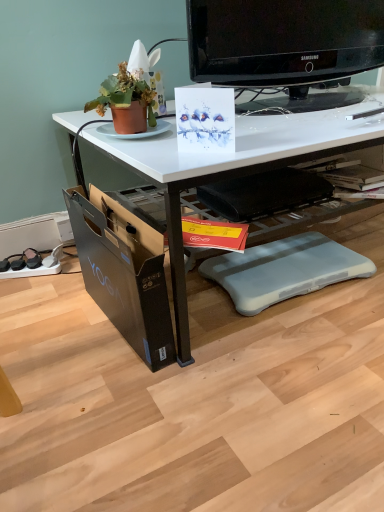
The image size is (384, 512). Describe the element at coordinates (264, 193) in the screenshot. I see `black plastic swivel chair at center, placed as the 1th swivel chair when sorted from top to bottom` at that location.

The image size is (384, 512). Describe the element at coordinates (284, 270) in the screenshot. I see `gray plastic swivel chair at lower center, placed as the second swivel chair when sorted from top to bottom` at that location.

Measure the distance between black glossy television at upper center and camera.

The distance of black glossy television at upper center from camera is 3.55 feet.

The image size is (384, 512). Describe the element at coordinates (129, 94) in the screenshot. I see `terracotta clay pot at upper left` at that location.

The height and width of the screenshot is (512, 384). What do you see at coordinates (213, 234) in the screenshot?
I see `yellow paper magazine at center` at bounding box center [213, 234].

In order to click on yellow paper magazine at center in this screenshot , I will do `click(213, 234)`.

Where is `white glossy desk at center`? This screenshot has height=512, width=384. white glossy desk at center is located at coordinates (236, 168).

Which of these two, gray plastic swivel chair at lower center, the 1th swivel chair from the bottom, or black cardboard file cabinet at lower left, stands taller?

With more height is black cardboard file cabinet at lower left.

Is gray plastic swivel chair at lower center, the 1th swivel chair from the bottom, situated inside black cardboard file cabinet at lower left or outside?

gray plastic swivel chair at lower center, the 1th swivel chair from the bottom, is not inside black cardboard file cabinet at lower left, it's outside.

From the image's perspective, is gray plastic swivel chair at lower center, placed as the second swivel chair when sorted from top to bottom, on black cardboard file cabinet at lower left?

Incorrect, from the image's perspective, gray plastic swivel chair at lower center, placed as the second swivel chair when sorted from top to bottom, is lower than black cardboard file cabinet at lower left.

Does point (258, 262) appear closer or farther from the camera than point (163, 245)?

Point (258, 262).

Could you tell me if black plastic swivel chair at center, placed as the 1th swivel chair when sorted from top to bottom, is facing gray plastic swivel chair at lower center, placed as the second swivel chair when sorted from top to bottom?

No.

From a real-world perspective, which is physically above, black plastic swivel chair at center, placed as the 1th swivel chair when sorted from top to bottom, or gray plastic swivel chair at lower center, the 1th swivel chair from the bottom?

In real-world perspective, black plastic swivel chair at center, placed as the 1th swivel chair when sorted from top to bottom, is above.

Is black plastic swivel chair at center, the 2th swivel chair when ordered from bottom to top, placed right next to gray plastic swivel chair at lower center, the 1th swivel chair from the bottom?

black plastic swivel chair at center, the 2th swivel chair when ordered from bottom to top, and gray plastic swivel chair at lower center, the 1th swivel chair from the bottom, are clearly separated.

Where is `the 1st swivel chair to the right of the yellow paper magazine at center, counting from the anchor's position`? This screenshot has height=512, width=384. the 1st swivel chair to the right of the yellow paper magazine at center, counting from the anchor's position is located at coordinates (264, 193).

From a real-world perspective, is black plastic swivel chair at center, the 2th swivel chair when ordered from bottom to top, under yellow paper magazine at center?

Incorrect, from a real-world perspective, black plastic swivel chair at center, the 2th swivel chair when ordered from bottom to top, is higher than yellow paper magazine at center.

Considering the relative sizes of black plastic swivel chair at center, the 2th swivel chair when ordered from bottom to top, and yellow paper magazine at center in the image provided, is black plastic swivel chair at center, the 2th swivel chair when ordered from bottom to top, thinner than yellow paper magazine at center?

No, black plastic swivel chair at center, the 2th swivel chair when ordered from bottom to top, is not thinner than yellow paper magazine at center.

Is black cardboard file cabinet at lower left positioned far away from black plastic swivel chair at center, the 2th swivel chair when ordered from bottom to top?

No, black cardboard file cabinet at lower left is not far away from black plastic swivel chair at center, the 2th swivel chair when ordered from bottom to top.

From a real-world perspective, is black cardboard file cabinet at lower left located beneath black plastic swivel chair at center, the 2th swivel chair when ordered from bottom to top?

Yes, from a real-world perspective, black cardboard file cabinet at lower left is under black plastic swivel chair at center, the 2th swivel chair when ordered from bottom to top.

Does black cardboard file cabinet at lower left contain black plastic swivel chair at center, the 2th swivel chair when ordered from bottom to top?

That's incorrect, black plastic swivel chair at center, the 2th swivel chair when ordered from bottom to top, is not inside black cardboard file cabinet at lower left.

In the image, is black cardboard file cabinet at lower left positioned in front of or behind black plastic swivel chair at center, placed as the 1th swivel chair when sorted from top to bottom?

black cardboard file cabinet at lower left is in front of black plastic swivel chair at center, placed as the 1th swivel chair when sorted from top to bottom.

From the image's perspective, does gray plastic swivel chair at lower center, placed as the second swivel chair when sorted from top to bottom, appear lower than yellow paper magazine at center?

Yes.

Based on the photo, which of these two, gray plastic swivel chair at lower center, placed as the second swivel chair when sorted from top to bottom, or yellow paper magazine at center, stands shorter?

yellow paper magazine at center.

Considering the relative positions of gray plastic swivel chair at lower center, the 1th swivel chair from the bottom, and yellow paper magazine at center in the image provided, is gray plastic swivel chair at lower center, the 1th swivel chair from the bottom, to the left or to the right of yellow paper magazine at center?

In the image, gray plastic swivel chair at lower center, the 1th swivel chair from the bottom, appears on the right side of yellow paper magazine at center.

Which object is thinner, gray plastic swivel chair at lower center, the 1th swivel chair from the bottom, or white glossy desk at center?

Thinner between the two is gray plastic swivel chair at lower center, the 1th swivel chair from the bottom.

Considering the sizes of objects gray plastic swivel chair at lower center, the 1th swivel chair from the bottom, and white glossy desk at center in the image provided, who is bigger, gray plastic swivel chair at lower center, the 1th swivel chair from the bottom, or white glossy desk at center?

white glossy desk at center is bigger.

In order to click on the 2nd swivel chair behind when counting from the white glossy desk at center in this screenshot , I will do `click(284, 270)`.

Is black plastic swivel chair at center, placed as the 1th swivel chair when sorted from top to bottom, to the right of white glossy desk at center from the viewer's perspective?

In fact, black plastic swivel chair at center, placed as the 1th swivel chair when sorted from top to bottom, is to the left of white glossy desk at center.

Could you tell me if black plastic swivel chair at center, the 2th swivel chair when ordered from bottom to top, is turned towards white glossy desk at center?

Yes, black plastic swivel chair at center, the 2th swivel chair when ordered from bottom to top, is aimed at white glossy desk at center.

Considering the relative sizes of black plastic swivel chair at center, placed as the 1th swivel chair when sorted from top to bottom, and white glossy desk at center in the image provided, is black plastic swivel chair at center, placed as the 1th swivel chair when sorted from top to bottom, smaller than white glossy desk at center?

Yes.

You are a GUI agent. You are given a task and a screenshot of the screen. Output one action in this format:
    pyautogui.click(x=<x>, y=<y>)
    Task: Click on the file cabinet that is in front of the gray plastic swivel chair at lower center, the 1th swivel chair from the bottom
    The height and width of the screenshot is (512, 384).
    Given the screenshot: What is the action you would take?
    click(124, 272)

Where is `swivel chair above the gray plastic swivel chair at lower center, the 1th swivel chair from the bottom (from a real-world perspective)`? This screenshot has height=512, width=384. swivel chair above the gray plastic swivel chair at lower center, the 1th swivel chair from the bottom (from a real-world perspective) is located at coordinates (264, 193).

Considering their positions, is black glossy television at upper center positioned further to black cardboard file cabinet at lower left than yellow paper magazine at center?

black glossy television at upper center lies further to black cardboard file cabinet at lower left than the other object.

Based on their spatial positions, is yellow paper magazine at center or black plastic swivel chair at center, placed as the 1th swivel chair when sorted from top to bottom, closer to white glossy desk at center?

Among the two, black plastic swivel chair at center, placed as the 1th swivel chair when sorted from top to bottom, is located nearer to white glossy desk at center.

When comparing their distances from yellow paper magazine at center, does black plastic swivel chair at center, the 2th swivel chair when ordered from bottom to top, or gray plastic swivel chair at lower center, placed as the second swivel chair when sorted from top to bottom, seem further?

gray plastic swivel chair at lower center, placed as the second swivel chair when sorted from top to bottom, is positioned further to the anchor yellow paper magazine at center.

In the scene shown: Considering their positions, is yellow paper magazine at center positioned further to black glossy television at upper center than black cardboard file cabinet at lower left?

The object further to black glossy television at upper center is black cardboard file cabinet at lower left.

Estimate the real-world distances between objects in this image. Which object is further from white glossy desk at center, gray plastic swivel chair at lower center, the 1th swivel chair from the bottom, or terracotta clay pot at upper left?

gray plastic swivel chair at lower center, the 1th swivel chair from the bottom.

Considering their positions, is terracotta clay pot at upper left positioned closer to yellow paper magazine at center than white glossy desk at center?

white glossy desk at center is closer to yellow paper magazine at center.

Looking at this image, which object lies nearer to the anchor point yellow paper magazine at center, white glossy desk at center or black glossy television at upper center?

Based on the image, white glossy desk at center appears to be nearer to yellow paper magazine at center.

Based on the photo, looking at the image, which one is located further to black cardboard file cabinet at lower left, terracotta clay pot at upper left or gray plastic swivel chair at lower center, placed as the second swivel chair when sorted from top to bottom?

Among the two, gray plastic swivel chair at lower center, placed as the second swivel chair when sorted from top to bottom, is located further to black cardboard file cabinet at lower left.

I want to click on desk situated between terracotta clay pot at upper left and black glossy television at upper center from left to right, so click(236, 168).

Find the location of a particular element. The width and height of the screenshot is (384, 512). desk between terracotta clay pot at upper left and gray plastic swivel chair at lower center, placed as the second swivel chair when sorted from top to bottom, in the up-down direction is located at coordinates (236, 168).

Image resolution: width=384 pixels, height=512 pixels. In order to click on magazine between terracotta clay pot at upper left and black cardboard file cabinet at lower left from top to bottom in this screenshot , I will do `click(213, 234)`.

This screenshot has height=512, width=384. I want to click on houseplant between black glossy television at upper center and yellow paper magazine at center in the vertical direction, so click(129, 94).